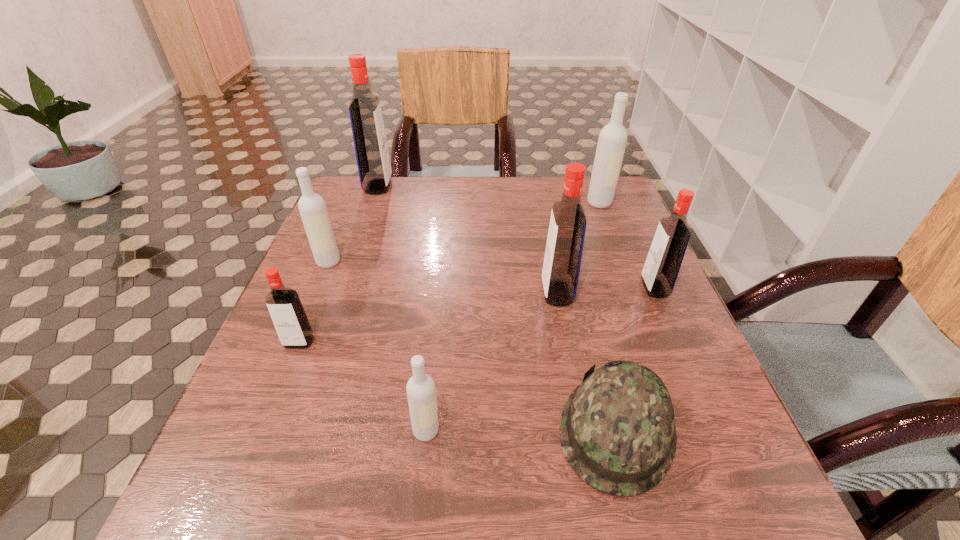
The width and height of the screenshot is (960, 540). What are the coordinates of `red vodka that is the second closest to the third biggest red vodka` in the screenshot? It's located at (287, 313).

Select which white vodka appears as the second closest to the tallest object. Please provide its 2D coordinates. Your answer should be formatted as a tuple, i.e. [(x, y)], where the tuple contains the x and y coordinates of a point satisfying the conditions above.

[(612, 140)]

This screenshot has width=960, height=540. Find the location of `white vodka that can be found as the second closest to the second biggest red vodka`. white vodka that can be found as the second closest to the second biggest red vodka is located at coordinates (421, 393).

At what (x,y) coordinates should I click in order to perform the action: click on vacant space that satisfies the following two spatial constraints: 1. on the back side of the headwear; 2. on the right side of the fourth vodka from right to left. Please return your answer as a coordinate pair (x, y). Looking at the image, I should click on (426, 430).

What are the coordinates of `vacant area that satisfies the following two spatial constraints: 1. on the front and back of the farthest red vodka; 2. on the back side of the fourth vodka from left to right` in the screenshot? It's located at (294, 430).

You are a GUI agent. You are given a task and a screenshot of the screen. Output one action in this format:
    pyautogui.click(x=<x>, y=<y>)
    Task: Click on the free region that satisfies the following two spatial constraints: 1. on the front and back of the headwear; 2. on the right side of the second nearest vodka
    The width and height of the screenshot is (960, 540).
    Given the screenshot: What is the action you would take?
    pyautogui.click(x=264, y=430)

Find the location of a particular element. free space that satisfies the following two spatial constraints: 1. on the front and back of the shortest object; 2. on the right side of the smallest red vodka is located at coordinates (264, 430).

Identify the location of free location that satisfies the following two spatial constraints: 1. on the front and back of the rightmost white vodka; 2. on the left side of the tallest object. (372, 202).

The width and height of the screenshot is (960, 540). Find the location of `free location that satisfies the following two spatial constraints: 1. on the front and back of the headwear; 2. on the left side of the tallest vodka`. free location that satisfies the following two spatial constraints: 1. on the front and back of the headwear; 2. on the left side of the tallest vodka is located at coordinates (294, 430).